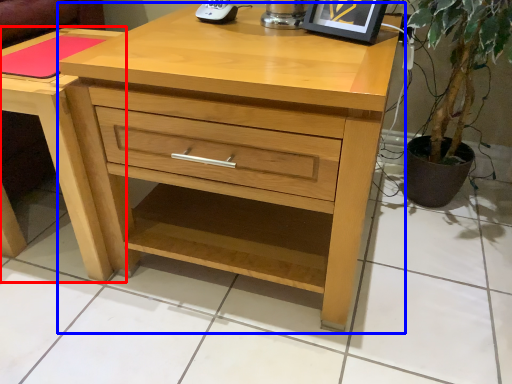
Question: Among these objects, which one is farthest to the camera, nightstand (highlighted by a red box) or chest of drawers (highlighted by a blue box)?

Choices:
 (A) nightstand
 (B) chest of drawers

Answer: (A)